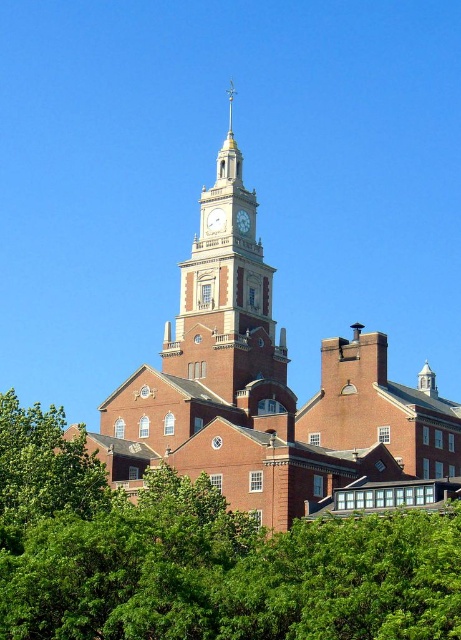
Where is `green leafy tree at center`? The image size is (461, 640). green leafy tree at center is located at coordinates (200, 556).

Which is more to the left, green leafy tree at center or brick clock tower at center?

green leafy tree at center is more to the left.

This screenshot has width=461, height=640. In order to click on green leafy tree at center in this screenshot , I will do `click(200, 556)`.

Between brick church at center and brick clock tower at center, which one is positioned higher?

Positioned higher is brick clock tower at center.

Who is positioned more to the right, brick church at center or brick clock tower at center?

From the viewer's perspective, brick church at center appears more on the right side.

In the scene shown: Who is more forward, (374,454) or (243,200)?

Positioned in front is point (374,454).

The width and height of the screenshot is (461, 640). I want to click on brick church at center, so click(270, 392).

Is brick church at center shorter than green leafy tree at lower left?

Incorrect, brick church at center's height does not fall short of green leafy tree at lower left's.

Find the location of `brick church at center`. brick church at center is located at coordinates (270, 392).